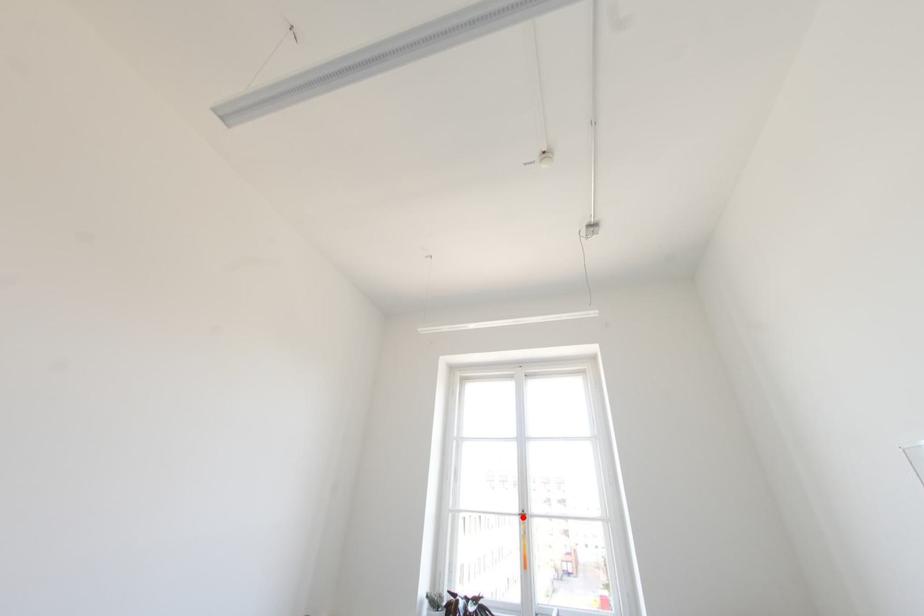
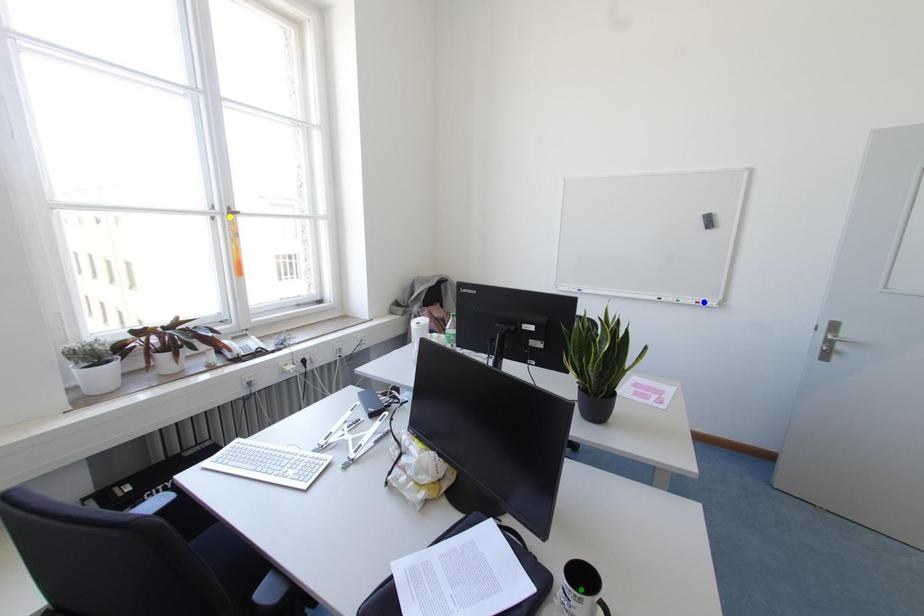
Question: I am providing you with two images of the same scene from different viewpoints. A red point is marked on the first image. You are given multiple points on the second image. Which point in image 2 is actually the same real-world point as the red point in image 1?

Choices:
 (A) green point
 (B) blue point
 (C) yellow point

Answer: (C)